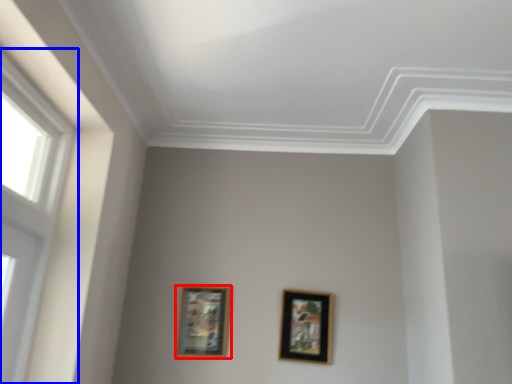
Question: Which point is closer to the camera, picture frame (highlighted by a red box) or window (highlighted by a blue box)?

Choices:
 (A) picture frame
 (B) window

Answer: (B)